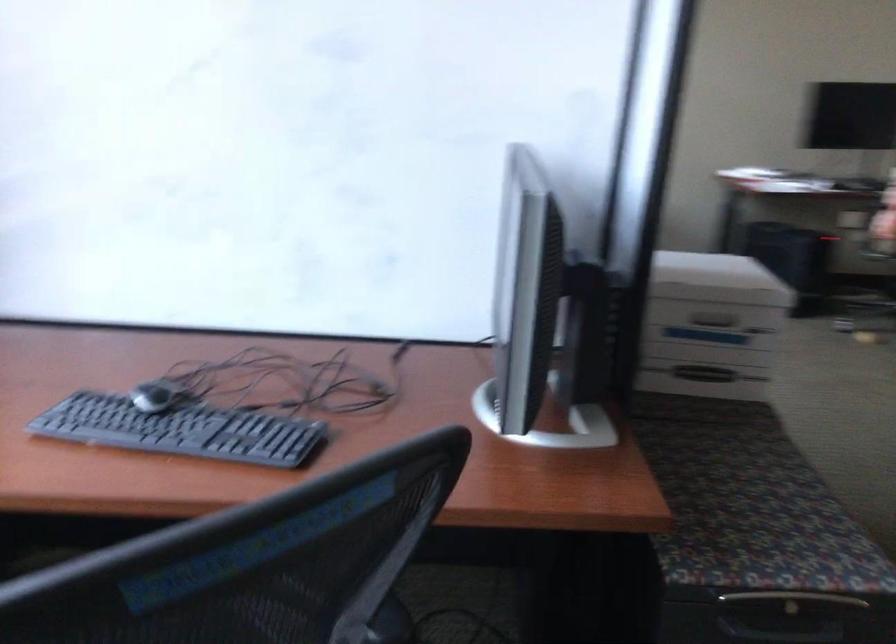
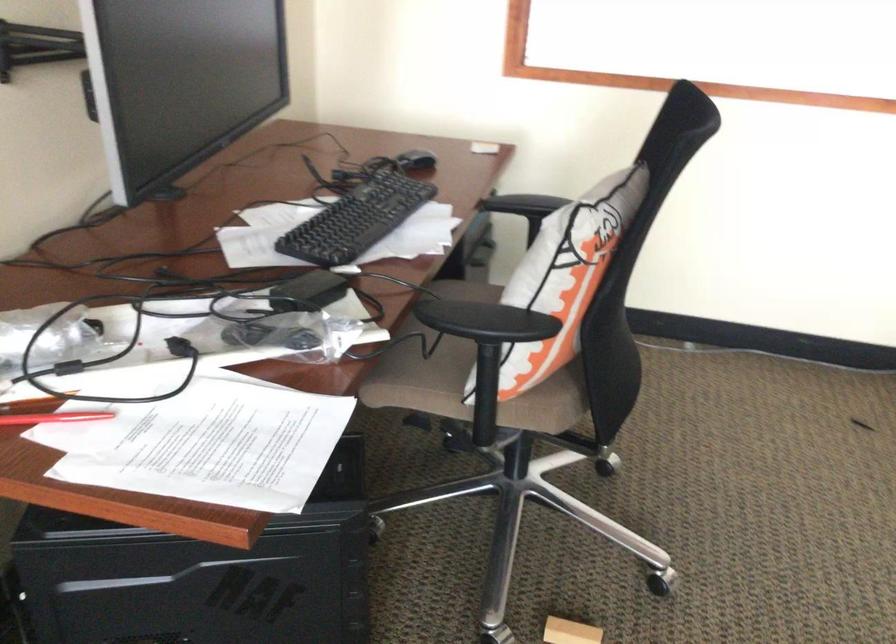
Locate, in the second image, the point that corresponds to [789,152] in the first image.

(54, 418)